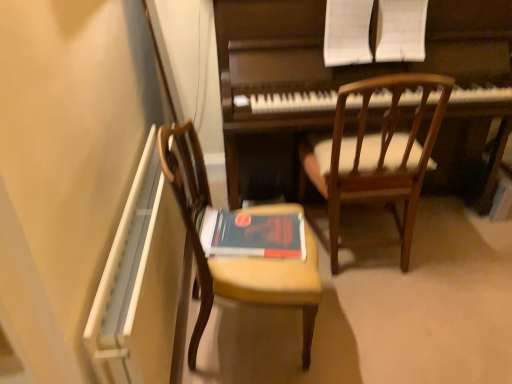
Locate an element on the screen. The height and width of the screenshot is (384, 512). vacant space underneath wooden chair at left, marked as the 2th chair in a right-to-left arrangement (from a real-world perspective) is located at coordinates (250, 335).